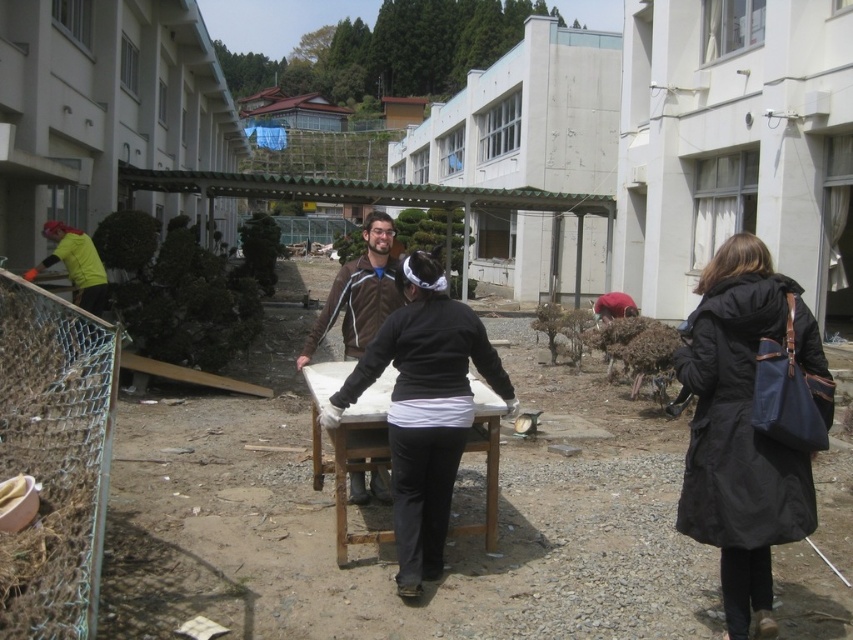
Is black fabric coat at right positioned in front of yellow-green fabric at left?

Yes, it is in front of yellow-green fabric at left.

Can you confirm if black fabric coat at right is bigger than yellow-green fabric at left?

Yes, black fabric coat at right is bigger than yellow-green fabric at left.

Does point (740, 381) lie behind point (91, 256)?

No, (740, 381) is closer to viewer.

Identify the location of black fabric coat at right. Image resolution: width=853 pixels, height=640 pixels. (751, 422).

Who is more distant from viewer, (457, 422) or (358, 483)?

Positioned behind is point (358, 483).

Between black matte jacket at center and brown leather jacket at center, which one appears on the right side from the viewer's perspective?

Positioned to the right is black matte jacket at center.

Where is `black matte jacket at center`? This screenshot has height=640, width=853. black matte jacket at center is located at coordinates (424, 406).

Who is positioned more to the right, black fabric coat at right or brown leather jacket at center?

black fabric coat at right

Locate an element on the screen. Image resolution: width=853 pixels, height=640 pixels. black fabric coat at right is located at coordinates [x=751, y=422].